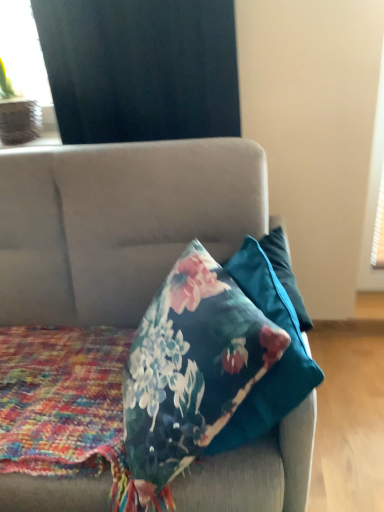
Question: From a real-world perspective, is black matte curtain at upper left above or below velvet floral pillow at center?

Choices:
 (A) above
 (B) below

Answer: (A)

Question: Would you say black matte curtain at upper left is to the left or to the right of velvet floral pillow at center in the picture?

Choices:
 (A) right
 (B) left

Answer: (A)

Question: Estimate the real-world distances between objects in this image. Which object is farther from the black matte curtain at upper left?

Choices:
 (A) matte black curtain at upper left
 (B) floral-patterned fabric at center
 (C) velvet floral pillow at center
 (D) floral fabric pillow at center

Answer: (B)

Question: Estimate the real-world distances between objects in this image. Which object is farther from the floral-patterned fabric at center?

Choices:
 (A) velvet floral pillow at center
 (B) black matte curtain at upper left
 (C) floral fabric pillow at center
 (D) matte black curtain at upper left

Answer: (D)